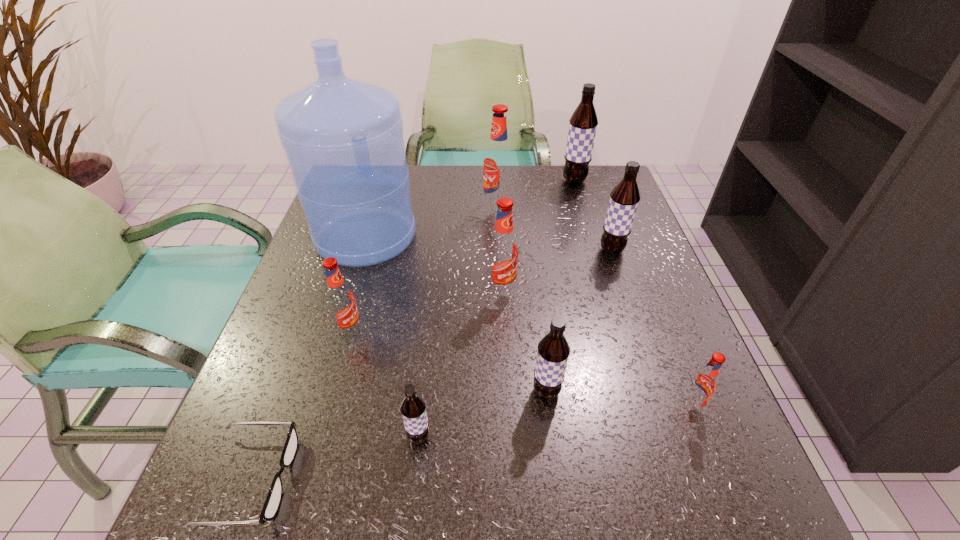
Identify the location of vacant space at the far edge of the desktop. (548, 167).

This screenshot has height=540, width=960. In the image, there is a desktop. In order to click on free space at the near edge in this screenshot , I will do `click(526, 488)`.

Find the location of `vacant space at the left edge of the desktop`. vacant space at the left edge of the desktop is located at coordinates (366, 276).

Where is `free spot at the right edge of the desktop`? The image size is (960, 540). free spot at the right edge of the desktop is located at coordinates (635, 417).

Identify the location of vacant space at the near left corner of the desktop. (222, 528).

This screenshot has height=540, width=960. I want to click on free spot at the far right corner of the desktop, so click(x=584, y=203).

You are a GUI agent. You are given a task and a screenshot of the screen. Output one action in this format:
    pyautogui.click(x=<x>, y=<y>)
    Task: Click on the vacant space at the near right corner of the desktop
    The image size is (960, 540).
    Given the screenshot: What is the action you would take?
    pyautogui.click(x=673, y=538)

The image size is (960, 540). I want to click on free space between the fourth farthest root beer and the water jug, so click(x=434, y=264).

This screenshot has width=960, height=540. Find the location of `free space that is in between the second farthest root beer and the nearest red root beer`. free space that is in between the second farthest root beer and the nearest red root beer is located at coordinates (594, 306).

Find the location of a particular element. The height and width of the screenshot is (540, 960). empty space that is in between the fourth object from left to right and the second smallest brown root beer is located at coordinates (483, 414).